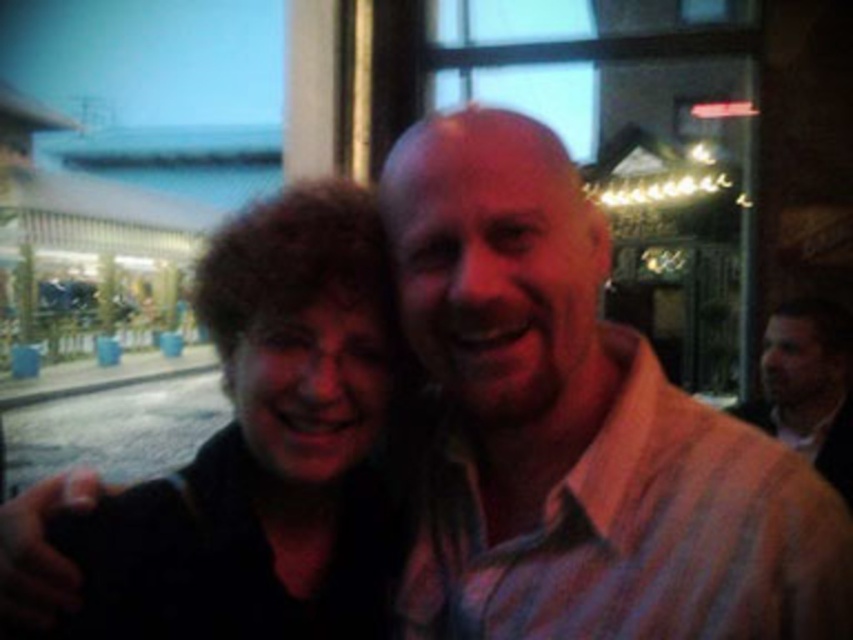
Between dark brown hair at left and light brown textured shirt at right, which one has less height?

Standing shorter between the two is light brown textured shirt at right.

Does dark brown hair at left have a lesser height compared to light brown textured shirt at right?

In fact, dark brown hair at left may be taller than light brown textured shirt at right.

Is point (260, 250) positioned in front of point (840, 454)?

Yes, it is.

The image size is (853, 640). Find the location of `dark brown hair at left`. dark brown hair at left is located at coordinates click(303, 412).